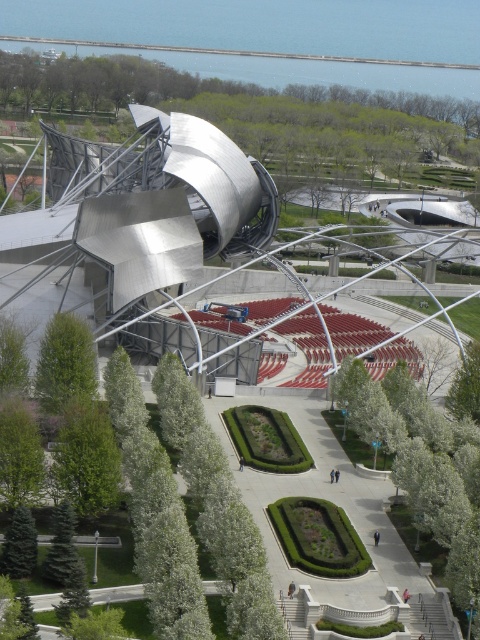
You are a landscape architect designing a new pathway between the green leafy tree at center and the green leafy tree at lower left. Since the trees have different widths, which tree requires a wider pathway to accommodate its size?

The green leafy tree at center requires a wider pathway because its width is larger than the green leafy tree at lower left.

You are standing at the entrance of the modern building and want to reach the point marked as point (74,374). There is an obstacle at point (453,531). Can you walk directly to your destination without going around the obstacle?

The point (453,531) is in front of point (74,374), so you cannot walk directly to point (74,374) without going around the obstacle at point (453,531).

Based on the photo, you are standing at the entrance of the building and want to find the green leafy tree at center. According to the coordinates, where should you look relative to your position?

The green leafy tree at center is located at coordinates point [444,474], which means it is positioned to the right and slightly forward from your current position at the entrance.